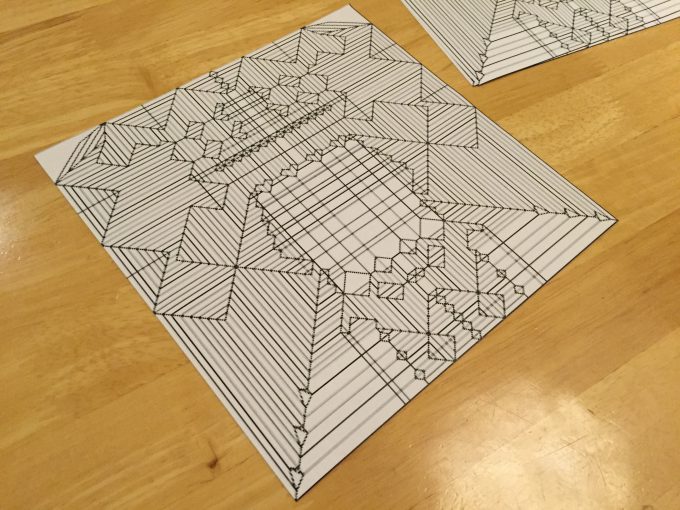
Identify the location of wood floor. This screenshot has height=510, width=680. (73, 36), (39, 350), (600, 418), (615, 131).